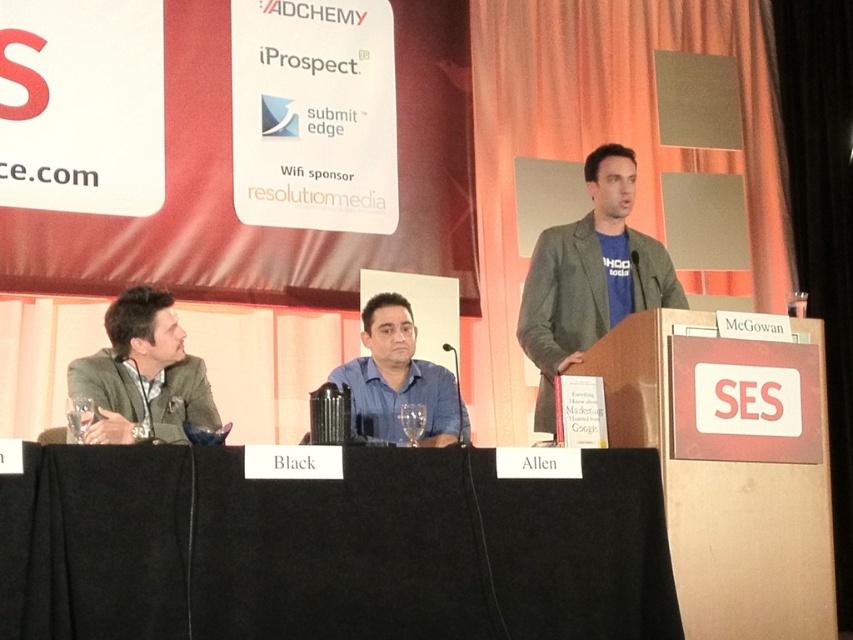
You are organizing a conference and need to place a 1.2 meter wide banner behind the black fabric table at center. Can the matte gray suit at left be moved to accommodate the banner without affecting the table?

The black fabric table at center is larger in size than the matte gray suit at left, so moving the matte gray suit at left might be possible to make space for the banner behind the table. However, the exact feasibility depends on the available space around the table and the suit.